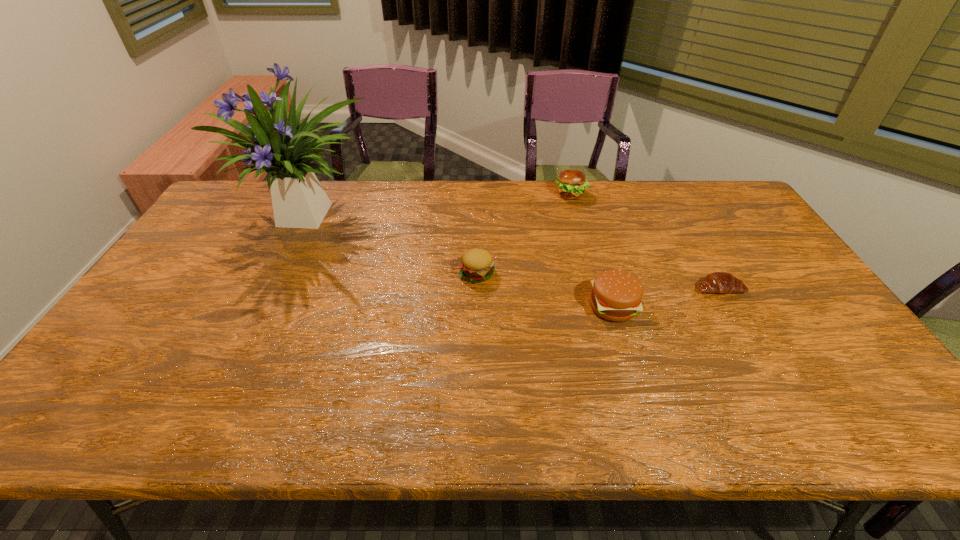
What are the coordinates of `vacant area at the far left corner` in the screenshot? It's located at (241, 201).

Locate an element on the screen. Image resolution: width=960 pixels, height=540 pixels. vacant space at the far right corner of the desktop is located at coordinates (740, 200).

At what (x,y) coordinates should I click in order to perform the action: click on vacant space that is in between the farthest hamburger and the leftmost object. Please return your answer as a coordinate pair (x, y). This screenshot has height=540, width=960. Looking at the image, I should click on (441, 205).

Identify the location of vacant area between the nearest hamburger and the rightmost object. Image resolution: width=960 pixels, height=540 pixels. (665, 298).

Where is `vacant space that is in between the shortest hamburger and the leftmost object`? This screenshot has height=540, width=960. vacant space that is in between the shortest hamburger and the leftmost object is located at coordinates (394, 244).

The image size is (960, 540). In order to click on vacant area that lies between the shortest object and the nearest hamburger in this screenshot , I will do point(665,298).

Where is `blank region between the tallest object and the leftmost hamburger`? This screenshot has height=540, width=960. blank region between the tallest object and the leftmost hamburger is located at coordinates (394, 244).

The width and height of the screenshot is (960, 540). In order to click on empty space that is in between the farthest hamburger and the shortest object in this screenshot , I will do `click(645, 241)`.

You are a GUI agent. You are given a task and a screenshot of the screen. Output one action in this format:
    pyautogui.click(x=<x>, y=<y>)
    Task: Click on the empty space that is in between the flower arrangement and the leftmost hamburger
    The image size is (960, 540).
    Given the screenshot: What is the action you would take?
    pyautogui.click(x=394, y=244)

Choose which object is the second nearest neighbor to the crescent roll. Please provide its 2D coordinates. Your answer should be formatted as a tuple, i.e. [(x, y)], where the tuple contains the x and y coordinates of a point satisfying the conditions above.

[(571, 184)]